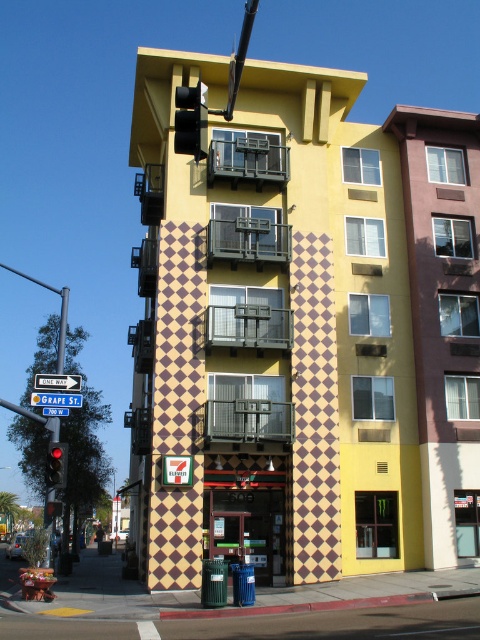
Question: Which object appears closest to the camera in this image?

Choices:
 (A) blue plastic street sign at upper center
 (B) metallic traffic light at upper left

Answer: (B)

Question: Can you confirm if red glass traffic light at left is wider than white plastic street sign at upper left?

Choices:
 (A) yes
 (B) no

Answer: (B)

Question: Can you confirm if metallic traffic light at upper left is positioned to the left of white plastic street sign at upper left?

Choices:
 (A) yes
 (B) no

Answer: (B)

Question: Does metallic traffic light at upper left have a larger size compared to white plastic street sign at upper left?

Choices:
 (A) yes
 (B) no

Answer: (A)

Question: Which of the following is the farthest from the observer?

Choices:
 (A) (52, 442)
 (B) (55, 380)
 (C) (38, 401)
 (D) (201, 90)

Answer: (B)

Question: Which is nearer to the blue plastic street sign at upper center?

Choices:
 (A) metallic traffic light at upper left
 (B) white plastic street sign at upper left
 (C) red glass traffic light at left

Answer: (B)